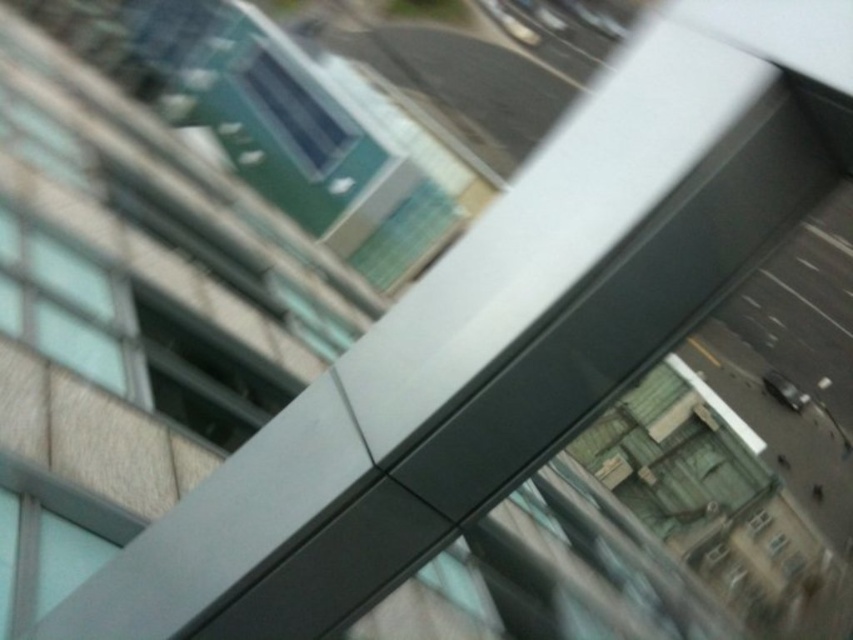
How far apart are matte glass window at center and matte glass window at upper center?

The distance of matte glass window at center from matte glass window at upper center is 14.89 meters.

Is point (204, 349) positioned after point (277, 115)?

That is False.

You are a GUI agent. You are given a task and a screenshot of the screen. Output one action in this format:
    pyautogui.click(x=<x>, y=<y>)
    Task: Click on the matte glass window at center
    The height and width of the screenshot is (640, 853).
    Given the screenshot: What is the action you would take?
    pyautogui.click(x=202, y=374)

Which is in front, point (294, 70) or point (751, 518)?

Point (751, 518) is in front.

Can you confirm if matte glass window at upper center is positioned to the left of transparent glass window at center?

Correct, you'll find matte glass window at upper center to the left of transparent glass window at center.

What are the coordinates of `matte glass window at upper center` in the screenshot? It's located at (296, 109).

Does matte glass window at center have a lesser height compared to clear glass window at center?

In fact, matte glass window at center may be taller than clear glass window at center.

Between matte glass window at center and clear glass window at center, which one is positioned lower?

clear glass window at center

In order to click on matte glass window at center in this screenshot , I will do `click(202, 374)`.

In order to click on matte glass window at center in this screenshot , I will do `click(202, 374)`.